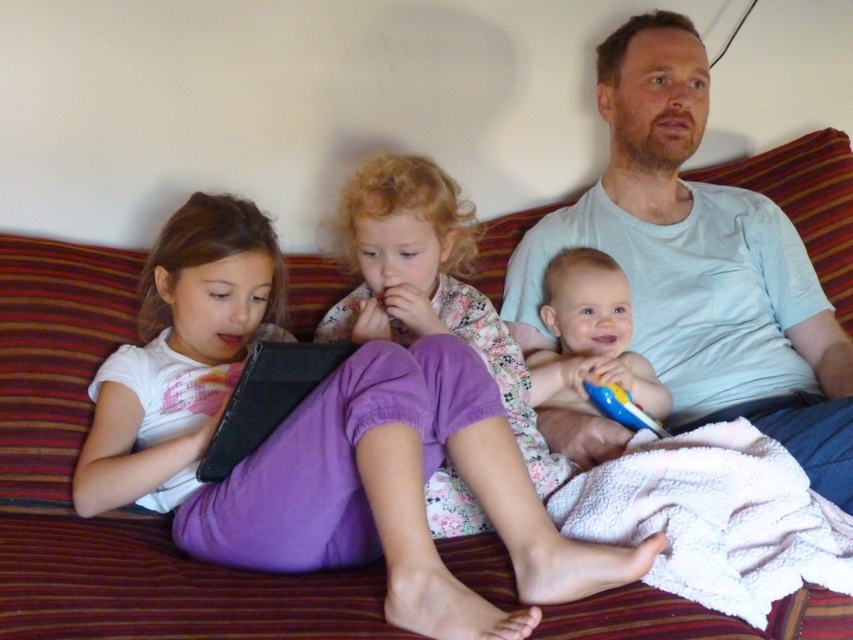
You are a photographer taking a picture of the family. You notice the floral fabric dress at center and the smooth plastic toy at center in the frame. Which object should you adjust to ensure both are fully visible in the photo?

The floral fabric dress at center is taller than the smooth plastic toy at center, so you should lower the camera angle to accommodate the height of the floral fabric dress at center.

You are a photographer taking a picture of the family scene. You notice the purple cotton pants at lower left and the yellow plastic spoon at right. Which object is closer to the left edge of the photo?

The purple cotton pants at lower left is closer to the left edge of the photo since it is positioned on the left side of the yellow plastic spoon at right.